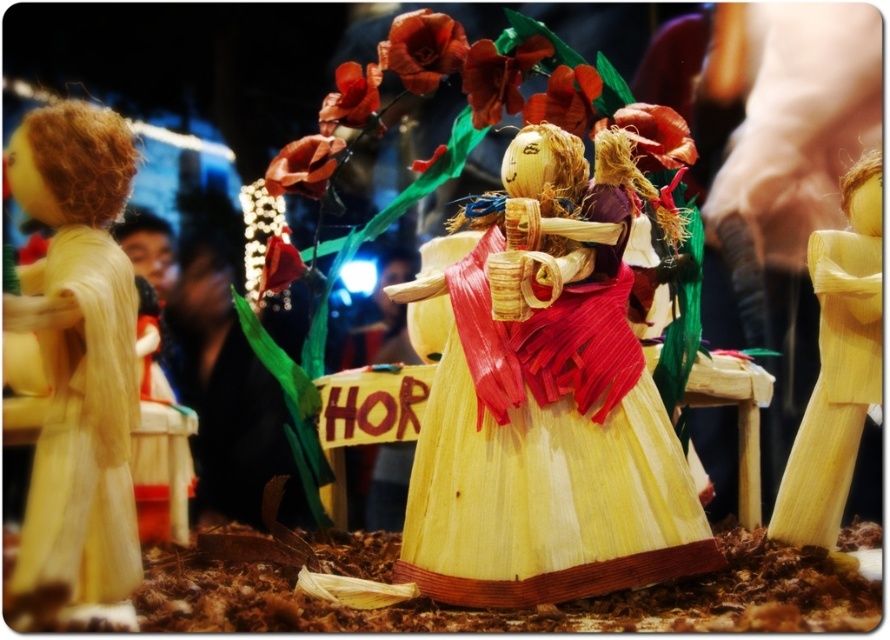
Does point (482, 529) come closer to viewer compared to point (101, 321)?

No, it is not.

Does natural straw dress at center lie in front of matte yellow corn husk doll at left?

No.

Between point (519, 604) and point (66, 257), which one is positioned behind?

Positioned behind is point (519, 604).

You are a GUI agent. You are given a task and a screenshot of the screen. Output one action in this format:
    pyautogui.click(x=<x>, y=<y>)
    Task: Click on the natural straw dress at center
    Image resolution: width=890 pixels, height=640 pixels.
    Given the screenshot: What is the action you would take?
    pyautogui.click(x=539, y=483)

Is point (67, 257) more distant than point (832, 346)?

No, (67, 257) is in front of (832, 346).

Who is more distant from viewer, (86,492) or (843,177)?

The point (843,177) is behind.

Image resolution: width=890 pixels, height=640 pixels. Find the location of `matte yellow corn husk doll at left`. matte yellow corn husk doll at left is located at coordinates (77, 353).

Find the location of a particular element. This screenshot has height=640, width=890. matte yellow corn husk doll at left is located at coordinates (77, 353).

Does natural straw dress at center have a larger size compared to natural straw doll at right?

Correct, natural straw dress at center is larger in size than natural straw doll at right.

Can you confirm if natural straw dress at center is smaller than natural straw doll at right?

Incorrect, natural straw dress at center is not smaller in size than natural straw doll at right.

Where is `natural straw dress at center`? The image size is (890, 640). natural straw dress at center is located at coordinates (539, 483).